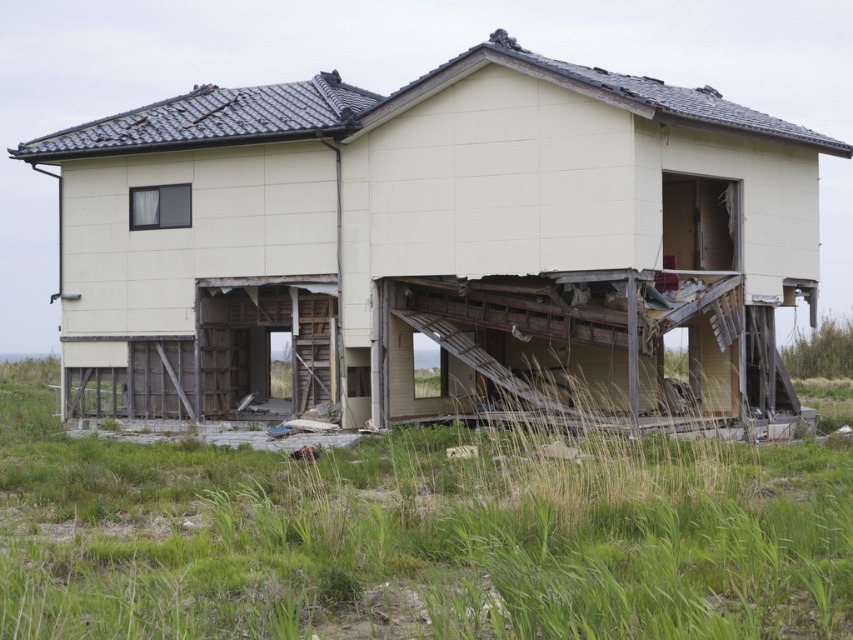
Question: Observing the image, what is the correct spatial positioning of beige wood house at center in reference to green grass at lower center?

Choices:
 (A) right
 (B) left

Answer: (B)

Question: Which point is farther to the camera?

Choices:
 (A) beige wood house at center
 (B) green grass at lower center

Answer: (A)

Question: Can you confirm if beige wood house at center is positioned to the right of green grass at lower center?

Choices:
 (A) no
 (B) yes

Answer: (A)

Question: Among these objects, which one is farthest from the camera?

Choices:
 (A) green grass at lower center
 (B) beige wood house at center

Answer: (B)

Question: Is beige wood house at center to the right of green grass at lower center from the viewer's perspective?

Choices:
 (A) yes
 (B) no

Answer: (B)